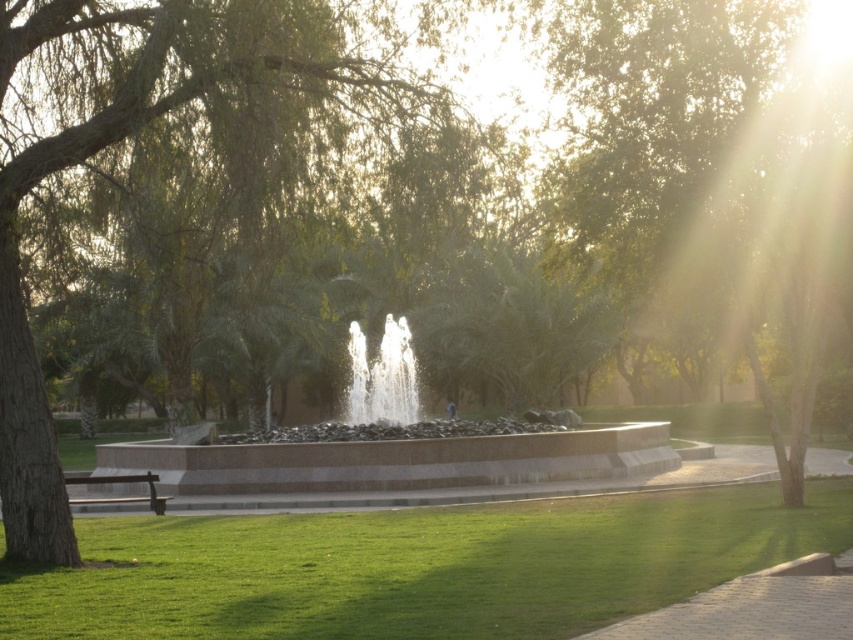
Who is positioned more to the left, green leafy tree at center or brown wooden bench at lower left?

brown wooden bench at lower left

Does green leafy tree at center have a smaller size compared to brown wooden bench at lower left?

Correct, green leafy tree at center occupies less space than brown wooden bench at lower left.

Does point (131, 12) come closer to viewer compared to point (161, 506)?

Yes, point (131, 12) is in front of point (161, 506).

At what (x,y) coordinates should I click in order to perform the action: click on green leafy tree at center. Please return your answer as a coordinate pair (x, y). The height and width of the screenshot is (640, 853). Looking at the image, I should click on (83, 163).

Can you confirm if green grass at lower center is thinner than green leafy tree at center?

No, green grass at lower center is not thinner than green leafy tree at center.

Does green grass at lower center have a lesser height compared to green leafy tree at center?

Yes.

Who is more forward, (521, 516) or (7, 252)?

Point (7, 252)

The image size is (853, 640). In order to click on green grass at lower center in this screenshot , I will do `click(416, 566)`.

In the scene shown: Who is higher up, green leafy tree at center or clear glass water at center?

green leafy tree at center

Is green leafy tree at center closer to camera compared to clear glass water at center?

Yes, green leafy tree at center is closer to the viewer.

What do you see at coordinates (83, 163) in the screenshot? The height and width of the screenshot is (640, 853). I see `green leafy tree at center` at bounding box center [83, 163].

This screenshot has height=640, width=853. Find the location of `green leafy tree at center`. green leafy tree at center is located at coordinates (83, 163).